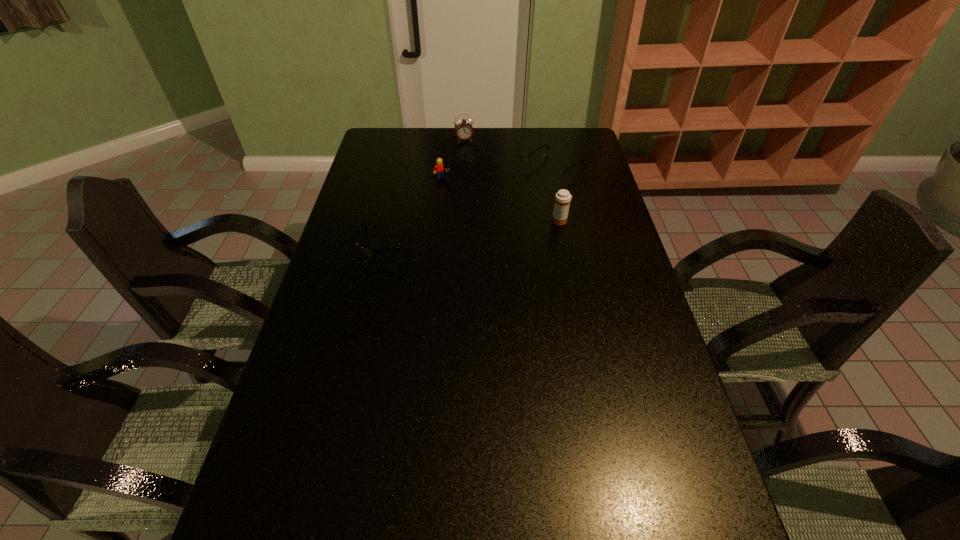
Locate an element on the screen. The height and width of the screenshot is (540, 960). free space located 0.290m at the hinge ends of the farther spectacles is located at coordinates (484, 219).

I want to click on vacant space located at the hinge ends of the farther spectacles, so (x=527, y=187).

Locate an element on the screen. This screenshot has width=960, height=540. vacant space located on the front-facing side of the Lego is located at coordinates (474, 228).

In order to click on vacant space located on the front-facing side of the Lego in this screenshot , I will do click(x=489, y=249).

Find the location of a particular element. The image size is (960, 540). vacant region located 0.310m on the front-facing side of the Lego is located at coordinates (480, 235).

Where is `blank area located 0.050m on the clock face of the alarm clock`? The height and width of the screenshot is (540, 960). blank area located 0.050m on the clock face of the alarm clock is located at coordinates (468, 150).

I want to click on free region located 0.100m on the clock face of the alarm clock, so click(x=470, y=157).

Where is `blank area located 0.230m on the clock face of the alarm clock`? The height and width of the screenshot is (540, 960). blank area located 0.230m on the clock face of the alarm clock is located at coordinates (476, 174).

Locate an element on the screen. The width and height of the screenshot is (960, 540). spectacles located in the far edge section of the desktop is located at coordinates (551, 174).

Where is `alarm clock located in the far edge section of the desktop`? The image size is (960, 540). alarm clock located in the far edge section of the desktop is located at coordinates (463, 128).